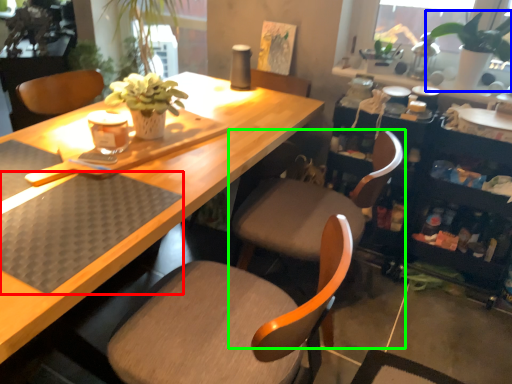
Question: Which object is positioned closest to wide (highlighted by a red box)? Select from houseplant (highlighted by a blue box) and chair (highlighted by a green box).

Choices:
 (A) houseplant
 (B) chair

Answer: (B)